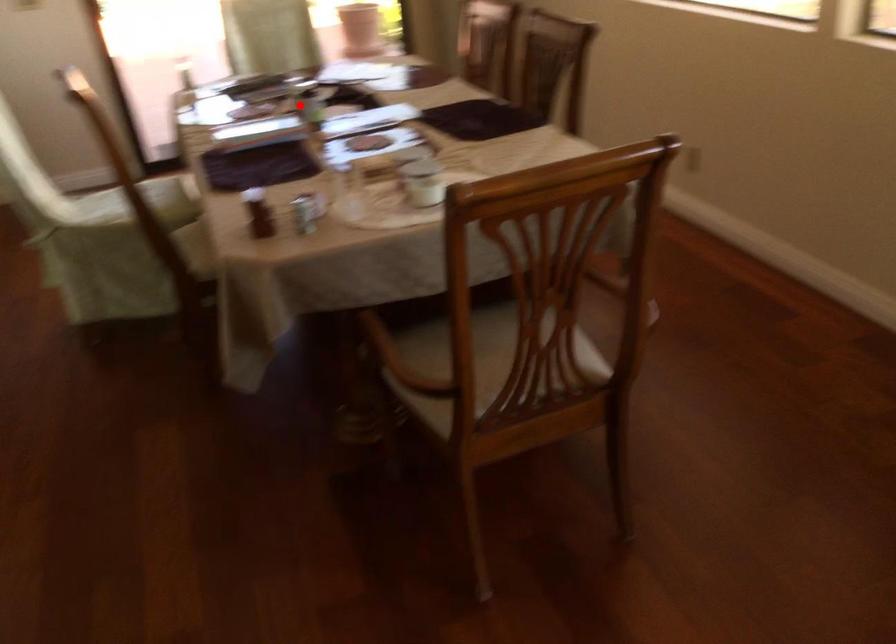
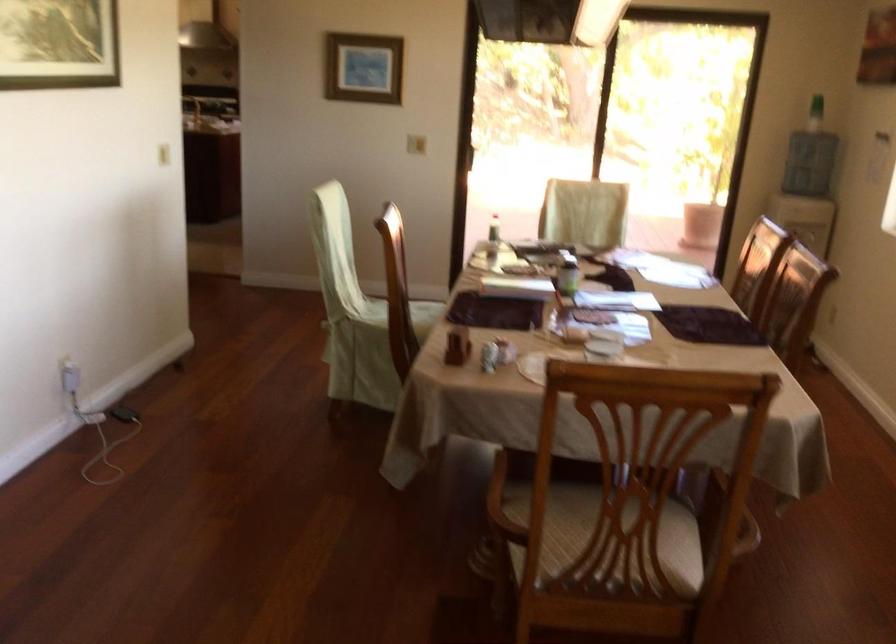
Question: I am providing you with two images of the same scene from different viewpoints. A red point is marked on the first image. At the location where the point appears in image 1, is it still visible in image 2?

Choices:
 (A) Yes
 (B) No

Answer: (A)